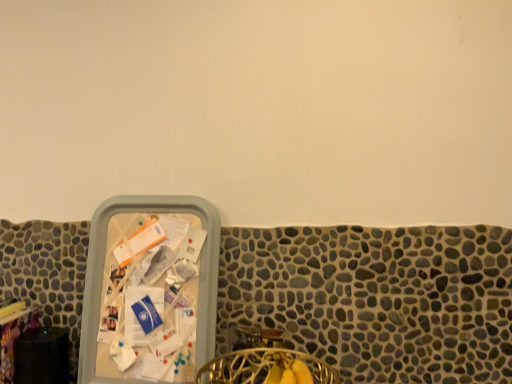
Question: From their relative heights in the image, would you say wooden table at lower left is taller or shorter than gold wire basket at lower center?

Choices:
 (A) tall
 (B) short

Answer: (A)

Question: From a real-world perspective, is wooden table at lower left above or below gold wire basket at lower center?

Choices:
 (A) above
 (B) below

Answer: (A)

Question: From the image's perspective, is wooden table at lower left above or below gold wire basket at lower center?

Choices:
 (A) above
 (B) below

Answer: (A)

Question: Considering the positions of point (317, 365) and point (10, 331), is point (317, 365) closer or farther from the camera than point (10, 331)?

Choices:
 (A) farther
 (B) closer

Answer: (B)

Question: From a real-world perspective, is gold wire basket at lower center above or below wooden table at lower left?

Choices:
 (A) below
 (B) above

Answer: (A)

Question: Looking at the image, does gold wire basket at lower center seem bigger or smaller compared to wooden table at lower left?

Choices:
 (A) small
 (B) big

Answer: (B)

Question: Visually, is gold wire basket at lower center positioned to the left or to the right of wooden table at lower left?

Choices:
 (A) left
 (B) right

Answer: (B)